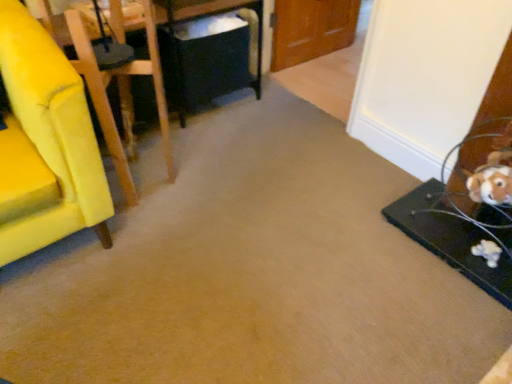
Question: In the image, is black matte table at right, which appears as the 1th table when viewed from the right, positioned in front of or behind black plastic table at center, marked as the 2th table in a bottom-to-top arrangement?

Choices:
 (A) behind
 (B) front

Answer: (B)

Question: Looking at their shapes, would you say black matte table at right, which appears as the 1th table when viewed from the right, is wider or thinner than black plastic table at center, the second table when ordered from right to left?

Choices:
 (A) wide
 (B) thin

Answer: (A)

Question: Which of these objects is positioned farthest from the yellow fabric chair at left?

Choices:
 (A) black matte table at right, which is the second table from back to front
 (B) black plastic table at center, which ranks as the first table in top-to-bottom order

Answer: (A)

Question: Which object is positioned farthest from the yellow fabric chair at left?

Choices:
 (A) black plastic table at center, the second table when ordered from right to left
 (B) black matte table at right, placed as the 2th table when sorted from left to right

Answer: (B)